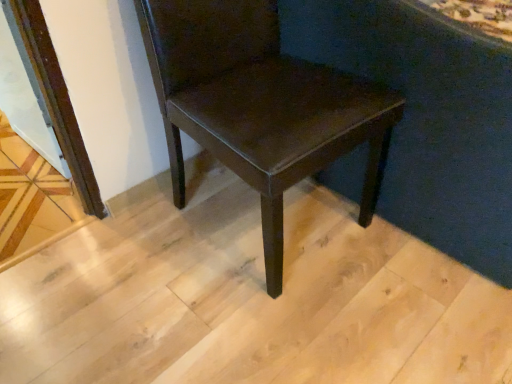
Where is `vacant space that is to the left of matte dark brown chair at center`? vacant space that is to the left of matte dark brown chair at center is located at coordinates (103, 261).